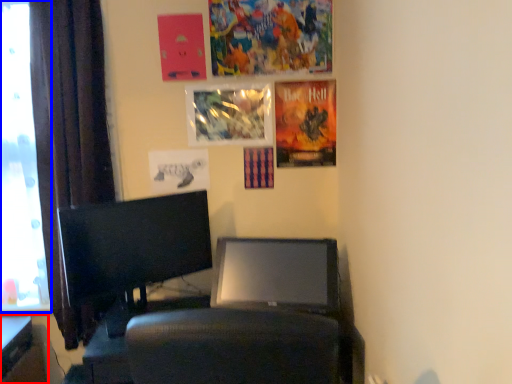
Question: Which point is closer to the camera, furniture (highlighted by a red box) or window screen (highlighted by a blue box)?

Choices:
 (A) furniture
 (B) window screen

Answer: (A)